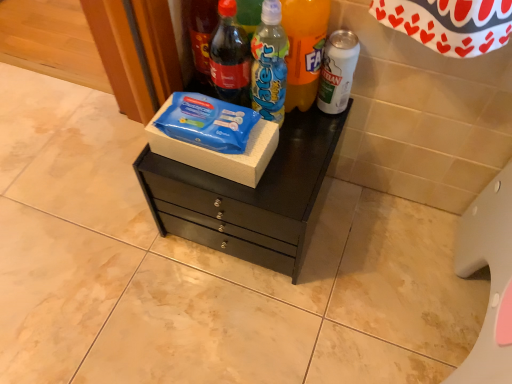
Where is `blue plastic bottle at center, positioned as the third bottle in right-to-left order`? The image size is (512, 384). blue plastic bottle at center, positioned as the third bottle in right-to-left order is located at coordinates (269, 64).

This screenshot has height=384, width=512. What are the coordinates of `translucent plastic water bottle at center, which ranks as the fourth bottle in left-to-right order` in the screenshot? It's located at (304, 49).

In order to face matte glass soda bottle at upper center, which ranks as the fourth bottle in right-to-left order, should I rotate leftwards or rightwards?

Turn left by 3.272 degrees to look at matte glass soda bottle at upper center, which ranks as the fourth bottle in right-to-left order.

Describe the element at coordinates (201, 35) in the screenshot. I see `matte glass soda bottle at upper left, which is the 5th bottle in right-to-left order` at that location.

Describe the element at coordinates (337, 71) in the screenshot. The image size is (512, 384). I see `white matte can at right, which is the fifth bottle from left to right` at that location.

What is the approximate height of blue plastic lunch box at center?

The height of blue plastic lunch box at center is 2.86 inches.

The height and width of the screenshot is (384, 512). I want to click on blue plastic bottle at center, positioned as the third bottle in right-to-left order, so click(x=269, y=64).

From a real-world perspective, which is physically below, black matte chest of drawers at center or matte glass soda bottle at upper left, the first bottle in the left-to-right sequence?

black matte chest of drawers at center.

Is black matte chest of drawers at center aimed at matte glass soda bottle at upper left, which is the 5th bottle in right-to-left order?

No, black matte chest of drawers at center is not turned towards matte glass soda bottle at upper left, which is the 5th bottle in right-to-left order.

Considering the positions of points (286, 203) and (192, 20), is point (286, 203) closer to camera compared to point (192, 20)?

Yes.

Looking at the image, does black matte chest of drawers at center seem bigger or smaller compared to matte glass soda bottle at upper left, the first bottle in the left-to-right sequence?

Clearly, black matte chest of drawers at center is larger in size than matte glass soda bottle at upper left, the first bottle in the left-to-right sequence.

Find the location of a particular element. Image resolution: width=512 pixels, height=384 pixels. chest of drawers to the right of matte glass soda bottle at upper center, which ranks as the fourth bottle in right-to-left order is located at coordinates (248, 196).

In the scene shown: From the image's perspective, which is below, matte glass soda bottle at upper center, which ranks as the fourth bottle in right-to-left order, or black matte chest of drawers at center?

black matte chest of drawers at center.

In the scene shown: Considering the sizes of matte glass soda bottle at upper center, which ranks as the fourth bottle in right-to-left order, and black matte chest of drawers at center in the image, is matte glass soda bottle at upper center, which ranks as the fourth bottle in right-to-left order, taller or shorter than black matte chest of drawers at center?

Considering their sizes, matte glass soda bottle at upper center, which ranks as the fourth bottle in right-to-left order, has less height than black matte chest of drawers at center.

Would you consider matte glass soda bottle at upper center, which appears as the 2th bottle when viewed from the left, to be distant from black matte chest of drawers at center?

No, matte glass soda bottle at upper center, which appears as the 2th bottle when viewed from the left, is in close proximity to black matte chest of drawers at center.

Which object is thinner, matte glass soda bottle at upper left, the first bottle in the left-to-right sequence, or black matte chest of drawers at center?

Thinner between the two is matte glass soda bottle at upper left, the first bottle in the left-to-right sequence.

In terms of size, does matte glass soda bottle at upper left, the first bottle in the left-to-right sequence, appear bigger or smaller than black matte chest of drawers at center?

matte glass soda bottle at upper left, the first bottle in the left-to-right sequence, is smaller than black matte chest of drawers at center.

Is point (214, 22) farther from camera compared to point (260, 260)?

No.

Considering the positions of objects white matte can at right, which is the fifth bottle from left to right, and matte glass soda bottle at upper center, which appears as the 2th bottle when viewed from the left, in the image provided, who is behind, white matte can at right, which is the fifth bottle from left to right, or matte glass soda bottle at upper center, which appears as the 2th bottle when viewed from the left,?

white matte can at right, which is the fifth bottle from left to right.

Would you consider white matte can at right, the first bottle from the right, to be distant from matte glass soda bottle at upper center, which ranks as the fourth bottle in right-to-left order?

No, there isn't a large distance between white matte can at right, the first bottle from the right, and matte glass soda bottle at upper center, which ranks as the fourth bottle in right-to-left order.

Considering the positions of objects white matte can at right, the first bottle from the right, and matte glass soda bottle at upper center, which appears as the 2th bottle when viewed from the left, in the image provided, who is more to the right, white matte can at right, the first bottle from the right, or matte glass soda bottle at upper center, which appears as the 2th bottle when viewed from the left,?

white matte can at right, the first bottle from the right, is more to the right.

From a real-world perspective, relative to black matte chest of drawers at center, is white matte can at right, the first bottle from the right, vertically above or below?

From a real-world perspective, white matte can at right, the first bottle from the right, is physically above black matte chest of drawers at center.

Which is correct: white matte can at right, the first bottle from the right, is inside black matte chest of drawers at center, or outside of it?

white matte can at right, the first bottle from the right, cannot be found inside black matte chest of drawers at center.

Locate an element on the screen. This screenshot has height=384, width=512. chest of drawers that appears on the left of white matte can at right, which is the fifth bottle from left to right is located at coordinates (248, 196).

Considering the points (338, 93) and (308, 208), which point is behind, point (338, 93) or point (308, 208)?

The point (338, 93) is farther.

From a real-world perspective, between matte glass soda bottle at upper left, which is the 5th bottle in right-to-left order, and blue plastic lunch box at center, who is vertically lower?

blue plastic lunch box at center, from a real-world perspective.

Who is bigger, matte glass soda bottle at upper left, the first bottle in the left-to-right sequence, or blue plastic lunch box at center?

blue plastic lunch box at center.

In the image, is matte glass soda bottle at upper left, the first bottle in the left-to-right sequence, positioned in front of or behind blue plastic lunch box at center?

matte glass soda bottle at upper left, the first bottle in the left-to-right sequence, is in front of blue plastic lunch box at center.

Considering the relative positions of blue plastic bottle at center, the third bottle when ordered from left to right, and white matte can at right, the first bottle from the right, in the image provided, is blue plastic bottle at center, the third bottle when ordered from left to right, to the left of white matte can at right, the first bottle from the right, from the viewer's perspective?

Indeed, blue plastic bottle at center, the third bottle when ordered from left to right, is positioned on the left side of white matte can at right, the first bottle from the right.

From the picture: From a real-world perspective, which object stands above the other?

blue plastic bottle at center, positioned as the third bottle in right-to-left order, is physically above.

Is blue plastic bottle at center, the third bottle when ordered from left to right, spatially inside white matte can at right, the first bottle from the right, or outside of it?

blue plastic bottle at center, the third bottle when ordered from left to right, exists outside the volume of white matte can at right, the first bottle from the right.

Could you measure the distance between blue plastic bottle at center, the third bottle when ordered from left to right, and white matte can at right, the first bottle from the right?

blue plastic bottle at center, the third bottle when ordered from left to right, and white matte can at right, the first bottle from the right, are 4.98 inches apart from each other.

From the image's perspective, count 5th bottles upward from the black matte chest of drawers at center and point to it. Please provide its 2D coordinates.

[(201, 35)]

This screenshot has width=512, height=384. What are the coordinates of `the chest of drawers directly beneath the matte glass soda bottle at upper center, which ranks as the fourth bottle in right-to-left order (from a real-world perspective)` in the screenshot? It's located at (248, 196).

Considering their positions, is translucent plastic water bottle at center, the second bottle viewed from the right, positioned further to blue plastic bottle at center, the third bottle when ordered from left to right, than matte glass soda bottle at upper left, the first bottle in the left-to-right sequence?

Based on the image, matte glass soda bottle at upper left, the first bottle in the left-to-right sequence, appears to be further to blue plastic bottle at center, the third bottle when ordered from left to right.

From the image, which object appears to be nearer to matte glass soda bottle at upper left, the first bottle in the left-to-right sequence, blue plastic bottle at center, positioned as the third bottle in right-to-left order, or blue plastic lunch box at center?

Among the two, blue plastic bottle at center, positioned as the third bottle in right-to-left order, is located nearer to matte glass soda bottle at upper left, the first bottle in the left-to-right sequence.

Considering their positions, is white matte can at right, which is the fifth bottle from left to right, positioned further to black matte chest of drawers at center than translucent plastic water bottle at center, the second bottle viewed from the right?

white matte can at right, which is the fifth bottle from left to right, is further to black matte chest of drawers at center.

When comparing their distances from blue plastic bottle at center, positioned as the third bottle in right-to-left order, does translucent plastic water bottle at center, the second bottle viewed from the right, or matte glass soda bottle at upper center, which ranks as the fourth bottle in right-to-left order, seem closer?

translucent plastic water bottle at center, the second bottle viewed from the right.

Estimate the real-world distances between objects in this image. Which object is further from white matte can at right, which is the fifth bottle from left to right, matte glass soda bottle at upper center, which ranks as the fourth bottle in right-to-left order, or matte glass soda bottle at upper left, which is the 5th bottle in right-to-left order?

Based on the image, matte glass soda bottle at upper left, which is the 5th bottle in right-to-left order, appears to be further to white matte can at right, which is the fifth bottle from left to right.

Looking at this image, based on their spatial positions, is translucent plastic water bottle at center, which ranks as the fourth bottle in left-to-right order, or matte glass soda bottle at upper left, the first bottle in the left-to-right sequence, closer to blue plastic lunch box at center?

translucent plastic water bottle at center, which ranks as the fourth bottle in left-to-right order, is closer to blue plastic lunch box at center.

Based on their spatial positions, is matte glass soda bottle at upper center, which ranks as the fourth bottle in right-to-left order, or black matte chest of drawers at center further from white matte can at right, which is the fifth bottle from left to right?

black matte chest of drawers at center lies further to white matte can at right, which is the fifth bottle from left to right, than the other object.

Based on their spatial positions, is translucent plastic water bottle at center, which ranks as the fourth bottle in left-to-right order, or white matte can at right, the first bottle from the right, further from blue plastic lunch box at center?

white matte can at right, the first bottle from the right, is further to blue plastic lunch box at center.

Where is `chest of drawers between matte glass soda bottle at upper center, which appears as the 2th bottle when viewed from the left, and white matte can at right, which is the fifth bottle from left to right, in the horizontal direction`? Image resolution: width=512 pixels, height=384 pixels. chest of drawers between matte glass soda bottle at upper center, which appears as the 2th bottle when viewed from the left, and white matte can at right, which is the fifth bottle from left to right, in the horizontal direction is located at coordinates (248, 196).

Find the location of `lunch box between matte glass soda bottle at upper left, which is the 5th bottle in right-to-left order, and white matte can at right, which is the fifth bottle from left to right, from left to right`. lunch box between matte glass soda bottle at upper left, which is the 5th bottle in right-to-left order, and white matte can at right, which is the fifth bottle from left to right, from left to right is located at coordinates (218, 152).

Find the location of a particular element. The height and width of the screenshot is (384, 512). lunch box between matte glass soda bottle at upper center, which ranks as the fourth bottle in right-to-left order, and black matte chest of drawers at center in the up-down direction is located at coordinates (218, 152).

Find the location of a particular element. The width and height of the screenshot is (512, 384). lunch box between blue plastic bottle at center, the third bottle when ordered from left to right, and black matte chest of drawers at center in the up-down direction is located at coordinates (218, 152).